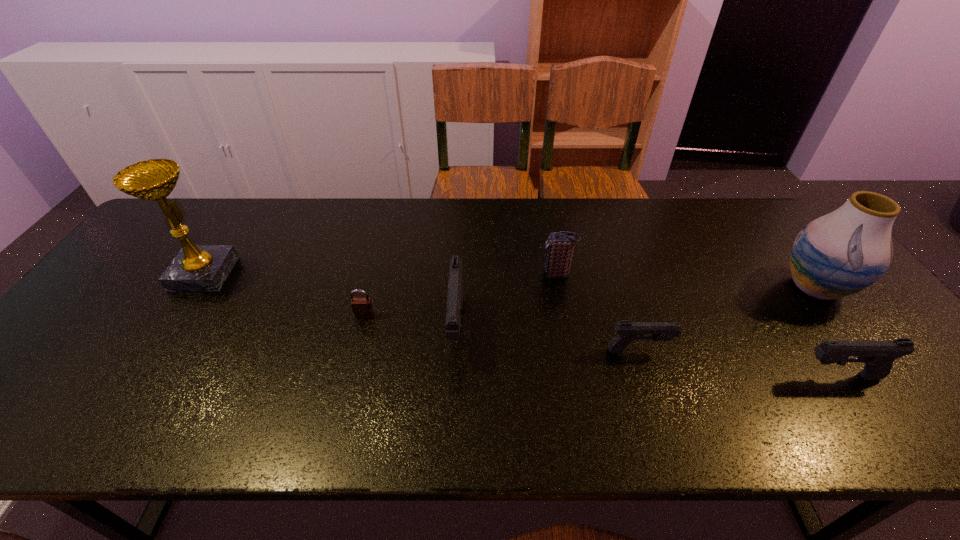
Identify the location of pistol that is the second closest to the shortest pistol. The image size is (960, 540). (455, 286).

Image resolution: width=960 pixels, height=540 pixels. In order to click on pistol that can be found as the closest to the nearest pistol in this screenshot , I will do `click(627, 331)`.

At what (x,y) coordinates should I click in order to perform the action: click on vacant area in the image that satisfies the following two spatial constraints: 1. with the zip open on the clutch bag; 2. at the barrel of the tallest pistol. Please return your answer as a coordinate pair (x, y). The height and width of the screenshot is (540, 960). Looking at the image, I should click on (567, 327).

Find the location of `vacant area in the image that satisfies the following two spatial constraints: 1. on the front-facing side of the leftmost object; 2. on the back side of the vase`. vacant area in the image that satisfies the following two spatial constraints: 1. on the front-facing side of the leftmost object; 2. on the back side of the vase is located at coordinates (196, 287).